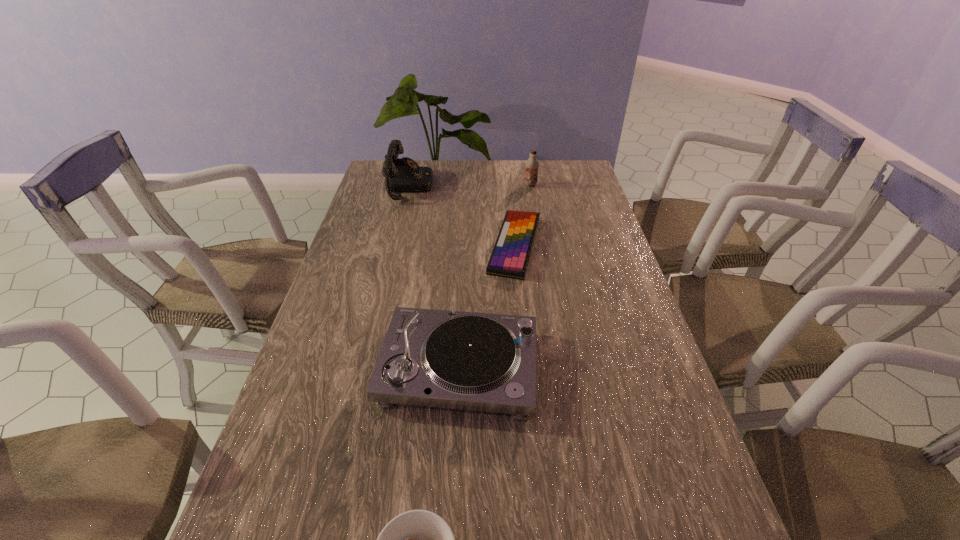
I want to click on vacant area between the chocolate milk and the telephone, so click(470, 185).

Locate an element on the screen. unoccupied position between the shortest object and the record player is located at coordinates (487, 306).

You are a GUI agent. You are given a task and a screenshot of the screen. Output one action in this format:
    pyautogui.click(x=<x>, y=<y>)
    Task: Click on the free spot between the third shortest object and the telephone
    
    Given the screenshot: What is the action you would take?
    pyautogui.click(x=434, y=276)

Where is `object that is the third closest to the nearest object`? This screenshot has width=960, height=540. object that is the third closest to the nearest object is located at coordinates (401, 175).

You are a GUI agent. You are given a task and a screenshot of the screen. Output one action in this format:
    pyautogui.click(x=<x>, y=<y>)
    Task: Click on the object identified as the closest to the chocolate milk
    This screenshot has height=540, width=960.
    Given the screenshot: What is the action you would take?
    pyautogui.click(x=511, y=253)

At what (x,y) coordinates should I click in order to perform the action: click on vacant space that satisfies the following two spatial constraints: 1. on the dial of the telephone; 2. on the back side of the fourth farthest object. Please return your answer as a coordinate pair (x, y). This screenshot has width=960, height=540. Looking at the image, I should click on (366, 367).

Identify the location of free space that satisfies the following two spatial constraints: 1. on the dial of the telephone; 2. on the right side of the second nearest object. (366, 367).

You are a GUI agent. You are given a task and a screenshot of the screen. Output one action in this format:
    pyautogui.click(x=<x>, y=<y>)
    Task: Click on the vacant space that satisfies the following two spatial constraints: 1. on the dial of the third shortest object; 2. on the right side of the telephone
    
    Given the screenshot: What is the action you would take?
    pyautogui.click(x=366, y=367)

Find the location of a particular element. The width and height of the screenshot is (960, 540). vacant area in the image that satisfies the following two spatial constraints: 1. on the front side of the chocolate milk; 2. on the dial of the telephone is located at coordinates (531, 186).